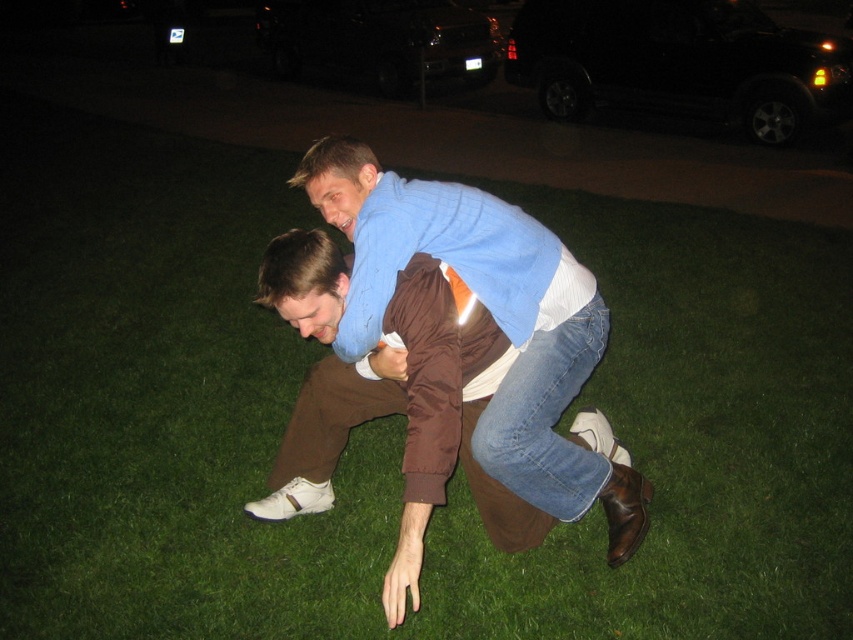
You are standing in a park at night and see two points marked in the image. Which point, point (x=552, y=412) or point (x=518, y=56), is closer to you?

Point (x=552, y=412) is closer to the viewer than point (x=518, y=56).

You are a photographer trying to capture both the blue cotton sweater at center and the black matte suv at upper center in a single shot. Based on their positions, which object is closer to the camera?

The blue cotton sweater at center is positioned under the black matte suv at upper center, so the blue cotton sweater at center is closer to the camera.

You are a photographer trying to capture both the blue cotton sweater at center and the black matte suv at upper center in a single frame. Based on their sizes in the image, which object should you focus on first to ensure both are in focus?

The blue cotton sweater at center is not as tall as the black matte suv at upper center, so you should focus on the black matte suv at upper center first since it is larger and will require more attention to detail to ensure both are in focus.